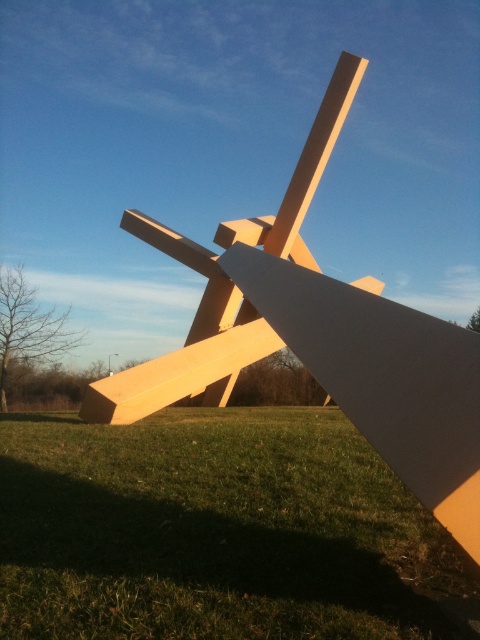
Can you confirm if green grass at lower center is thinner than matte wood cross at center?

Correct, green grass at lower center's width is less than matte wood cross at center's.

Is green grass at lower center wider than matte wood cross at center?

In fact, green grass at lower center might be narrower than matte wood cross at center.

Find the location of a particular element. green grass at lower center is located at coordinates (217, 531).

At what (x,y) coordinates should I click in order to perform the action: click on green grass at lower center. Please return your answer as a coordinate pair (x, y). The height and width of the screenshot is (640, 480). Looking at the image, I should click on (217, 531).